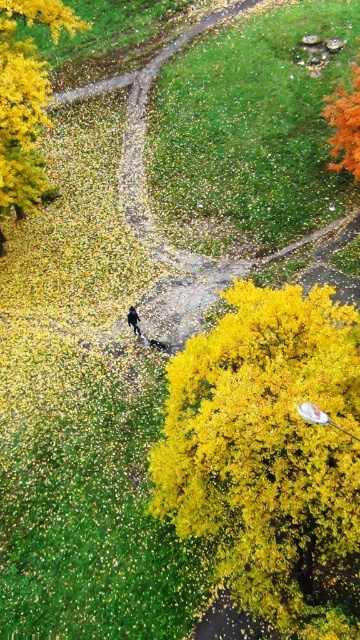
In the scene shown: You are standing at the viewpoint and want to reach the point marked as point (165, 429) in the park. If your walking speed is 1.5 meters per second, how many seconds will it take you to reach that point?

The distance between you and point (165, 429) is 24.80 meters. At a speed of 1.5 meters per second, it will take approximately 16.5 seconds to reach the point.

You are standing at the center of the park and want to walk to the golden textured bush at lower right. Which direction should you turn to face the golden textured leaves at upper left before proceeding?

You should turn to your left to face the golden textured leaves at upper left, as the golden textured bush at lower right is to the right of the golden textured leaves at upper left.